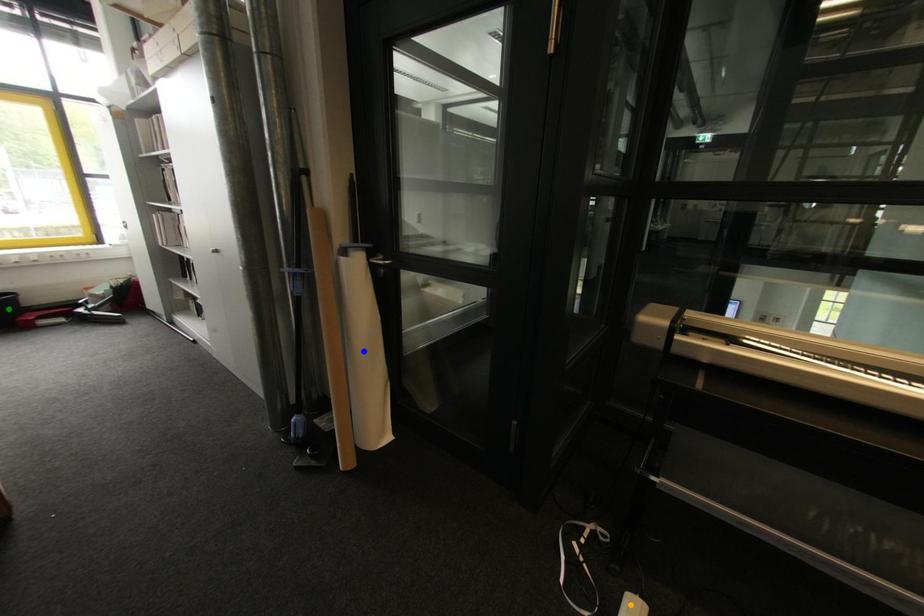
Order these from nearest to farthest:
blue point | green point | orange point

orange point
green point
blue point